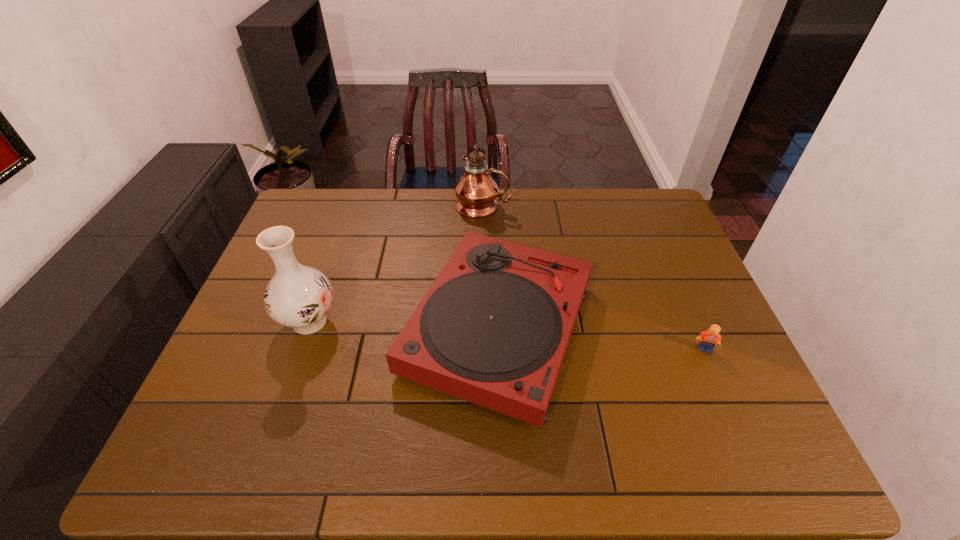
Where is `vacant space situated 0.110m on the front-facing side of the rightmost object`? vacant space situated 0.110m on the front-facing side of the rightmost object is located at coordinates (724, 393).

The image size is (960, 540). Identify the location of object positioned at the far edge. (476, 191).

Find the location of a particular element. object at the near edge is located at coordinates (493, 328).

This screenshot has width=960, height=540. In order to click on object positioned at the left edge in this screenshot , I will do `click(298, 296)`.

What are the coordinates of `object present at the right edge` in the screenshot? It's located at (711, 337).

You are a GUI agent. You are given a task and a screenshot of the screen. Output one action in this format:
    pyautogui.click(x=<x>, y=<y>)
    Task: Click on the free space at the far edge of the desktop
    This screenshot has width=960, height=540.
    Given the screenshot: What is the action you would take?
    pyautogui.click(x=568, y=227)

Where is `vacant space at the near edge of the desktop`? This screenshot has width=960, height=540. vacant space at the near edge of the desktop is located at coordinates (684, 462).

Identify the location of vacant space at the left edge. This screenshot has width=960, height=540. (317, 239).

Locate an element on the screen. This screenshot has height=540, width=960. blank space at the right edge of the desktop is located at coordinates (699, 308).

Image resolution: width=960 pixels, height=540 pixels. Find the location of `free point at the far left corner`. free point at the far left corner is located at coordinates (327, 200).